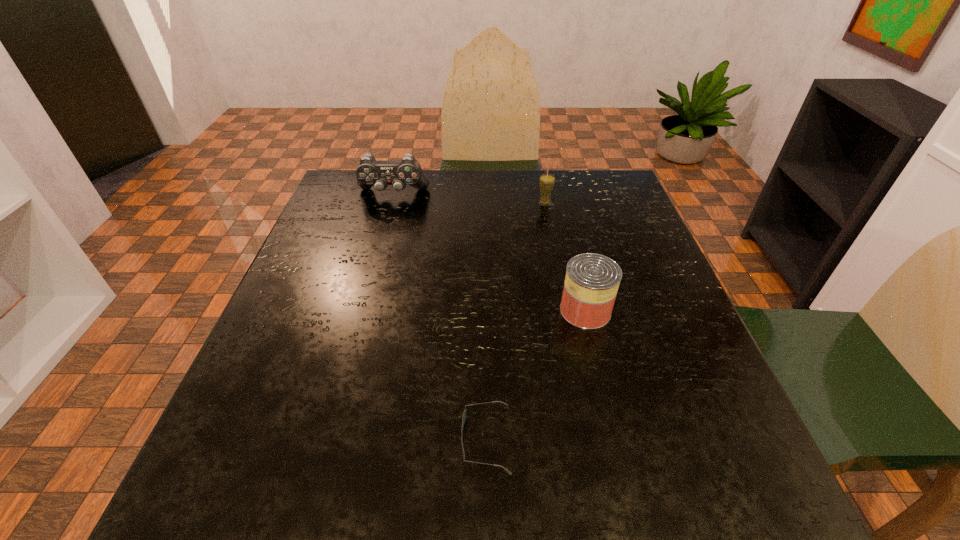
Identify the location of blank area at the right edge. This screenshot has height=540, width=960. (648, 342).

Where is `free region at the far left corner of the desktop`? The height and width of the screenshot is (540, 960). free region at the far left corner of the desktop is located at coordinates pos(358,187).

Locate an element on the screen. Image resolution: width=960 pixels, height=540 pixels. vacant region at the far right corner of the desktop is located at coordinates (583, 192).

Image resolution: width=960 pixels, height=540 pixels. In order to click on free space between the straw for drinking and the sunglasses in this screenshot , I will do `click(516, 321)`.

This screenshot has width=960, height=540. I want to click on blank region between the straw for drinking and the shortest object, so click(x=516, y=321).

Image resolution: width=960 pixels, height=540 pixels. In order to click on free space between the can and the control in this screenshot , I will do `click(490, 253)`.

At what (x,y) coordinates should I click in order to perform the action: click on free space between the can and the straw for drinking. Please return your answer as a coordinate pair (x, y). This screenshot has height=540, width=960. Looking at the image, I should click on 564,256.

This screenshot has height=540, width=960. Find the location of `empty location between the nearest object and the straw for drinking`. empty location between the nearest object and the straw for drinking is located at coordinates (516, 321).

I want to click on empty space that is in between the leftmost object and the second object from left to right, so click(440, 317).

Identify the location of vacant space that is in between the straw for drinking and the control. (468, 199).